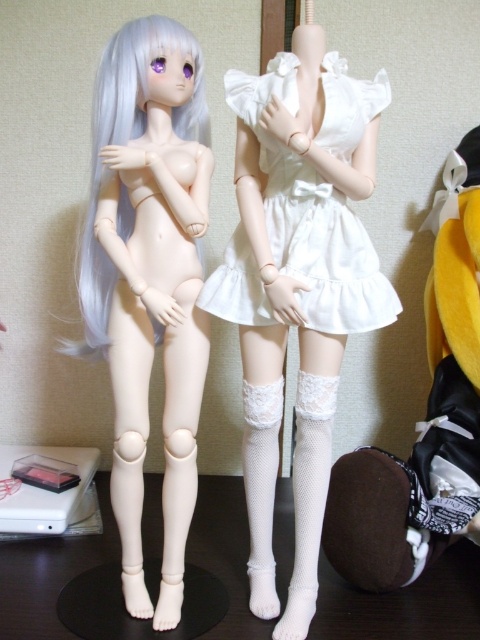
Question: Which point appears farthest from the camera in this image?

Choices:
 (A) (248, 252)
 (B) (468, 355)
 (C) (109, 109)

Answer: (B)

Question: Based on their relative distances, which object is nearer to the white matte wig at upper left?

Choices:
 (A) white lace socks at lower right
 (B) white satin dress at center

Answer: (B)

Question: Is white satin dress at center bigger than white matte wig at upper left?

Choices:
 (A) yes
 (B) no

Answer: (B)

Question: In this image, where is white satin dress at center located relative to white matte wig at upper left?

Choices:
 (A) above
 (B) below

Answer: (B)

Question: Does white matte dress at center have a smaller size compared to white matte wig at upper left?

Choices:
 (A) yes
 (B) no

Answer: (B)

Question: Which of the following is the farthest from the observer?

Choices:
 (A) white lace socks at lower right
 (B) white satin dress at center
 (C) white matte dress at center

Answer: (A)